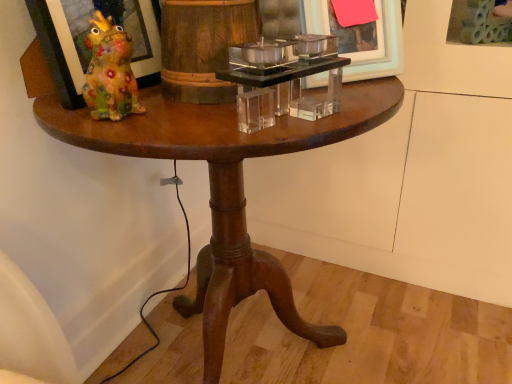
You are a GUI agent. You are given a task and a screenshot of the screen. Output one action in this format:
    pyautogui.click(x=<x>, y=<y>)
    Task: Click on the vacant space underneath clear acrylic candle holder at center (from a real-world perspective)
    
    Given the screenshot: What is the action you would take?
    pyautogui.click(x=259, y=109)